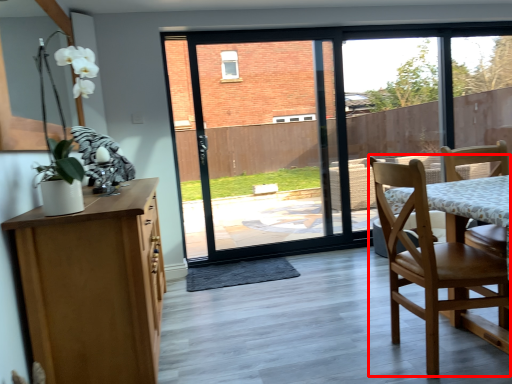
Question: Considering the relative positions of chair (annotated by the red box) and window screen in the image provided, where is chair (annotated by the red box) located with respect to the staircase?

Choices:
 (A) left
 (B) right

Answer: (B)